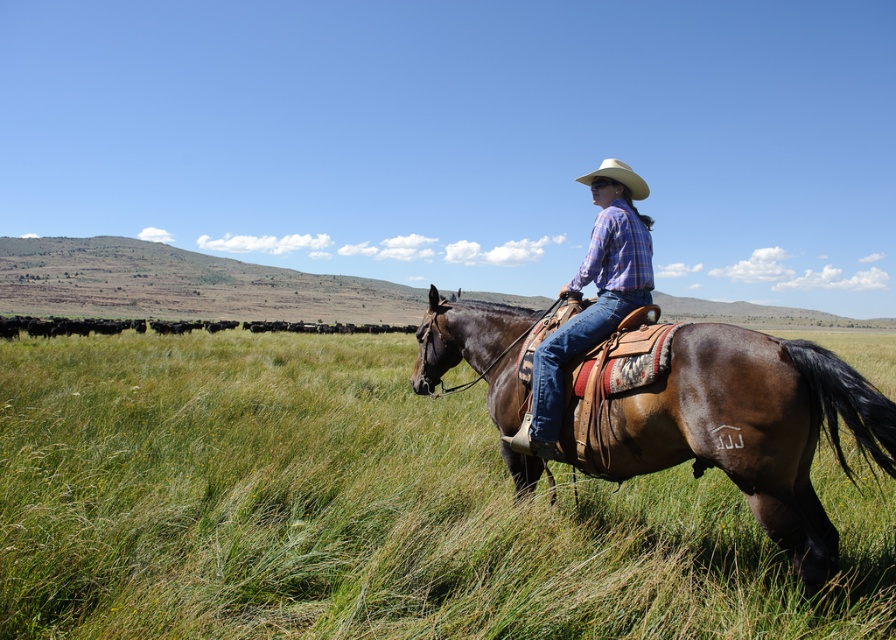
Identify the location of plaid shirt at center. The image size is (896, 640). (596, 298).

In the scene shown: Between plaid shirt at center and straw hat at upper center, which one appears on the right side from the viewer's perspective?

Positioned to the right is straw hat at upper center.

Find the location of `plaid shirt at center`. plaid shirt at center is located at coordinates (596, 298).

This screenshot has width=896, height=640. What are the coordinates of `plaid shirt at center` in the screenshot? It's located at click(596, 298).

Does green grassy field at center have a greater width compared to plaid shirt at center?

Correct, the width of green grassy field at center exceeds that of plaid shirt at center.

Is green grassy field at center taller than plaid shirt at center?

No, green grassy field at center is not taller than plaid shirt at center.

The width and height of the screenshot is (896, 640). Describe the element at coordinates (367, 509) in the screenshot. I see `green grassy field at center` at that location.

Identify the location of green grassy field at center. (367, 509).

Can you confirm if green grassy field at center is positioned to the left of straw hat at upper center?

Indeed, green grassy field at center is positioned on the left side of straw hat at upper center.

Is green grassy field at center thinner than straw hat at upper center?

No.

Describe the element at coordinates (367, 509) in the screenshot. Image resolution: width=896 pixels, height=640 pixels. I see `green grassy field at center` at that location.

Where is `green grassy field at center`? green grassy field at center is located at coordinates (367, 509).